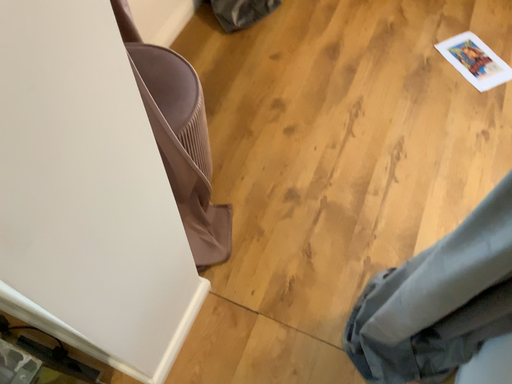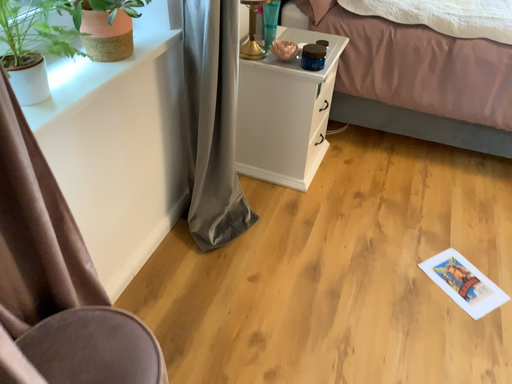
Question: How did the camera likely rotate when shooting the video?

Choices:
 (A) rotated upward
 (B) rotated downward

Answer: (A)